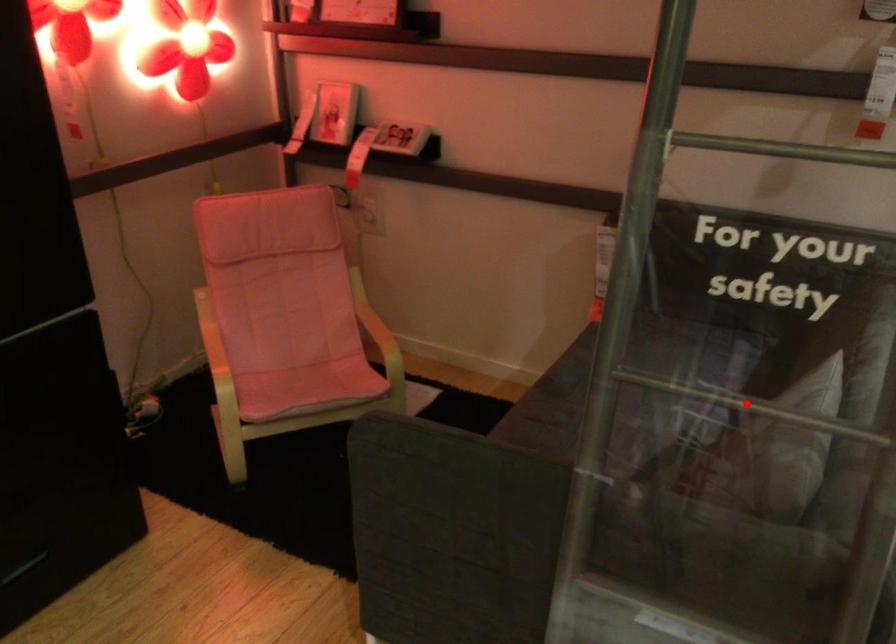
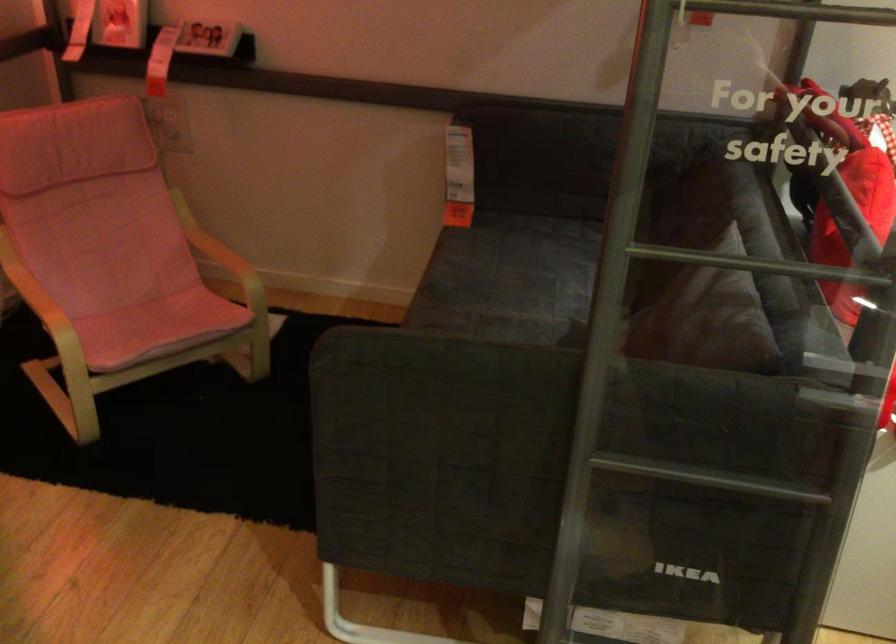
Locate, in the second image, the point that corresponds to the highlighted location in the first image.

(760, 263)